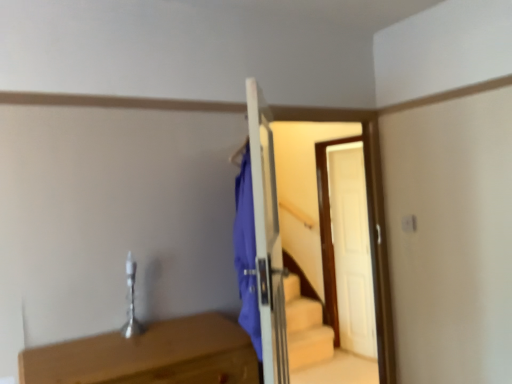
Question: Based on their sizes in the image, would you say white wooden door at center is bigger or smaller than light brown wooden table at lower left?

Choices:
 (A) big
 (B) small

Answer: (A)

Question: Considering the relative positions of white wooden door at center and light brown wooden table at lower left in the image provided, is white wooden door at center to the left or to the right of light brown wooden table at lower left?

Choices:
 (A) right
 (B) left

Answer: (A)

Question: From the image's perspective, is white wooden door at center located above or below light brown wooden table at lower left?

Choices:
 (A) below
 (B) above

Answer: (B)

Question: Does point (134, 379) appear closer or farther from the camera than point (259, 114)?

Choices:
 (A) farther
 (B) closer

Answer: (B)

Question: Looking at their shapes, would you say light brown wooden table at lower left is wider or thinner than white wooden door at center?

Choices:
 (A) thin
 (B) wide

Answer: (B)

Question: Visually, is light brown wooden table at lower left positioned to the left or to the right of white wooden door at center?

Choices:
 (A) left
 (B) right

Answer: (A)

Question: Choose the correct answer: Is light brown wooden table at lower left inside white wooden door at center or outside it?

Choices:
 (A) inside
 (B) outside

Answer: (B)